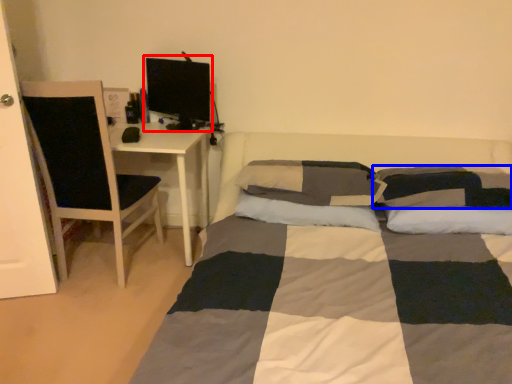
Question: Which object is further to the camera taking this photo, computer monitor (highlighted by a red box) or pillow (highlighted by a blue box)?

Choices:
 (A) computer monitor
 (B) pillow

Answer: (A)